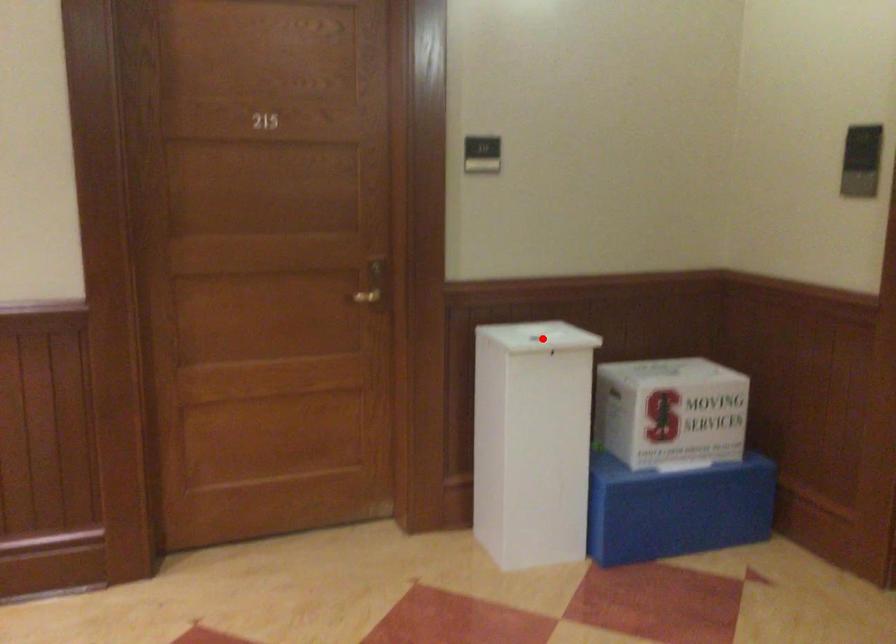
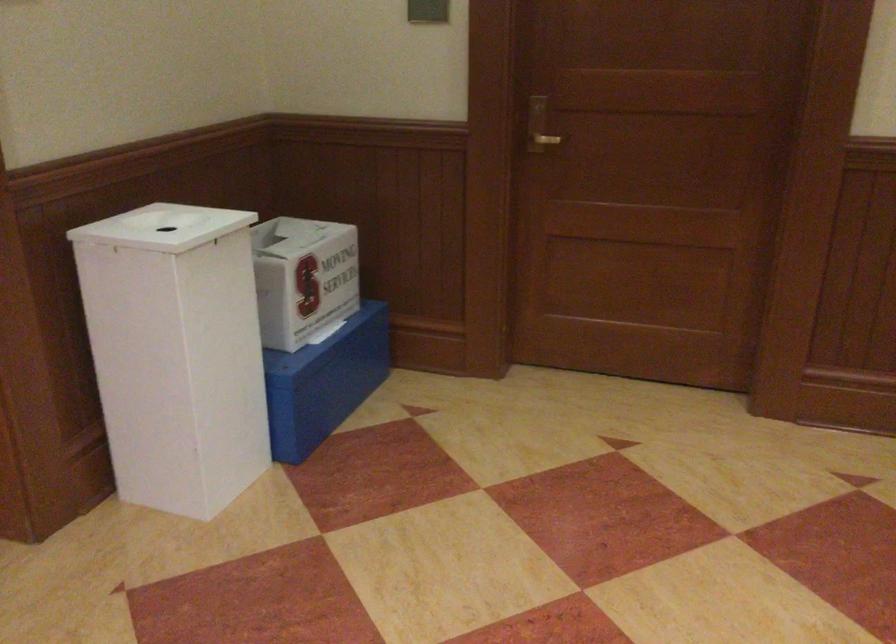
Find the pixel in the second image that matches the highlighted location in the first image.

(164, 227)